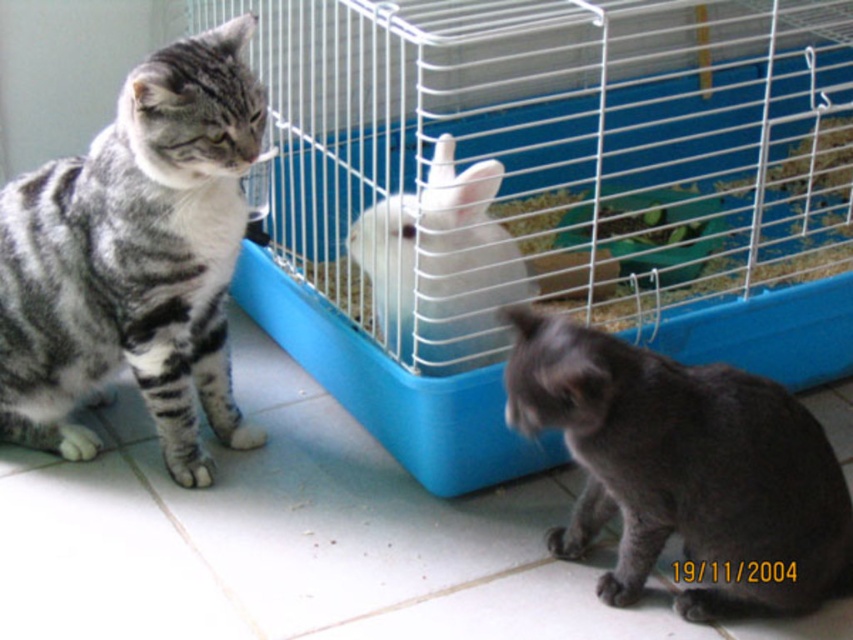
You are a small pet that needs to jump from the tabby cat on the left to the white wire bird cage at center. Can you make the jump?

The distance between the tabby cat on the left and the white wire bird cage at center is 4.21 feet. Whether the pet can jump this distance depends on the pet species and its jumping ability. For example, a rabbit might have difficulty jumping 4.21 feet, while a cat could manage it more easily. However, without knowing the specific pet type and its capabilities, it is impossible to definitively answer this question.

You are a small toy that needs to fit into either the white wire bird cage at center or the white fluffy bunny at center. Based on their sizes, which one can you fit into?

The white wire bird cage at center has a larger width than the white fluffy bunny at center, so the toy can fit into the white wire bird cage at center.